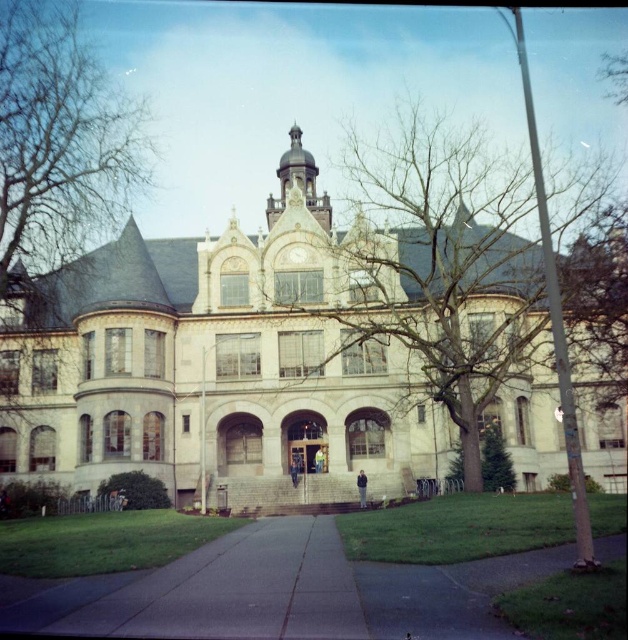
You are standing in front of the historic building and want to take a photo. You notice two points marked in the scene. The first point is at coordinates point (386, 385), and the second is at point (271, 540). Which point is closer to your camera position?

Point (271, 540) is closer to the camera position because the description states that point (386, 385) is further away than point (271, 540).

You are a photographer planning to take a picture of the white stone mansion at center and the smooth asphalt path at center from a distance. Which object will appear taller in the photo?

The white stone mansion at center will appear taller in the photo because it has a greater height compared to the smooth asphalt path at center.